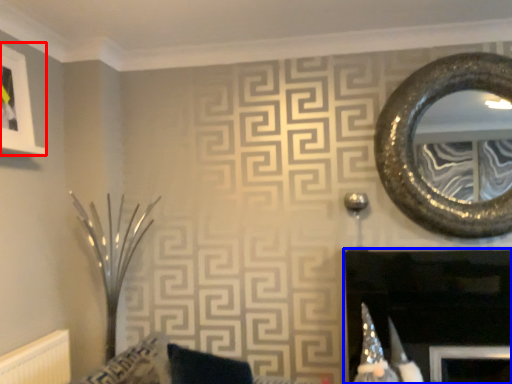
Question: Which of the following is the farthest to the observer, picture frame (highlighted by a red box) or fireplace (highlighted by a blue box)?

Choices:
 (A) picture frame
 (B) fireplace

Answer: (A)